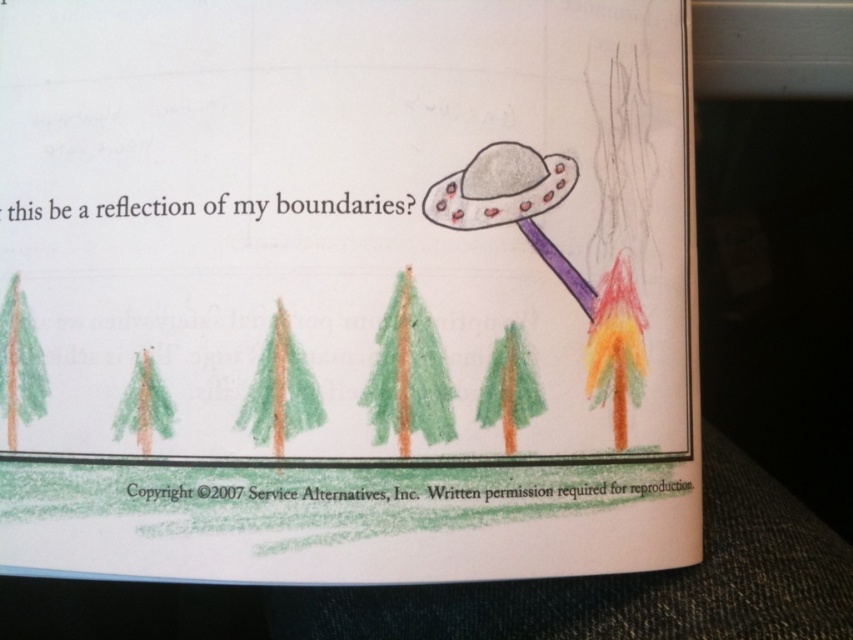
Question: Estimate the real-world distances between objects in this image. Which object is farther from the green crayon tree at left?

Choices:
 (A) black paper at upper center
 (B) green crayon tree at center
 (C) black paper at lower center

Answer: (B)

Question: Is black paper at lower center above black paper at upper center?

Choices:
 (A) no
 (B) yes

Answer: (A)

Question: Which object is farther from the camera taking this photo?

Choices:
 (A) multicolored crayon tree at right
 (B) green textured tree at center

Answer: (A)

Question: Can you confirm if black paper at lower center is positioned above green matte tree at center?

Choices:
 (A) no
 (B) yes

Answer: (A)

Question: Which point is closer to the camera taking this photo?

Choices:
 (A) (590, 380)
 (B) (262, 422)

Answer: (B)

Question: Does black paper at upper center lie in front of green crayon tree at center?

Choices:
 (A) yes
 (B) no

Answer: (A)